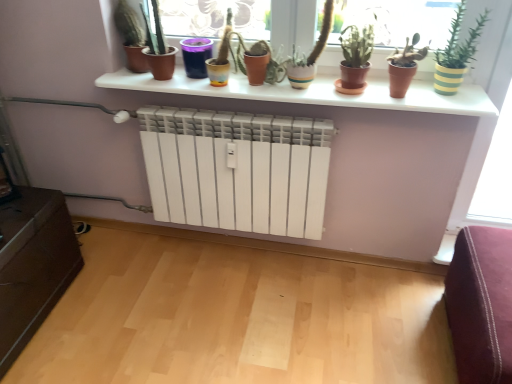
This screenshot has height=384, width=512. In order to click on matte black pot at upper left, which appears as the 1th houseplant when viewed from the left in this screenshot , I will do click(131, 36).

This screenshot has height=384, width=512. Find the location of `terracotta clay pot at center, positioned as the fourth houseplant in left-to-right order`. terracotta clay pot at center, positioned as the fourth houseplant in left-to-right order is located at coordinates (404, 67).

Describe the element at coordinates (227, 42) in the screenshot. I see `matte yellow pot at center` at that location.

At what (x,y) coordinates should I click in order to perform the action: click on green matte plant at center, placed as the third houseplant when sorted from right to left. Please return your answer as a coordinate pair (x, y). The image size is (512, 384). Looking at the image, I should click on (355, 59).

Image resolution: width=512 pixels, height=384 pixels. What do you see at coordinates (355, 59) in the screenshot?
I see `green matte plant at center, placed as the third houseplant when sorted from right to left` at bounding box center [355, 59].

I want to click on green matte cactus at upper left, arranged as the 4th houseplant when viewed from the right, so click(x=159, y=49).

Image resolution: width=512 pixels, height=384 pixels. Find the location of `yellow-green striped pot at upper right, the 5th houseplant positioned from the left`. yellow-green striped pot at upper right, the 5th houseplant positioned from the left is located at coordinates (457, 53).

Describe the element at coordinates (196, 56) in the screenshot. I see `purple glass vase at center, which is counted as the second vase, starting from the right` at that location.

What do you see at coordinates (313, 93) in the screenshot? This screenshot has width=512, height=384. I see `white matte shelf at upper center` at bounding box center [313, 93].

Identify the location of matte black pot at upper left, which appears as the 1th houseplant when viewed from the left. Image resolution: width=512 pixels, height=384 pixels. (131, 36).

Between terracotta clay pot at center, positioned as the 2th houseplant in right-to-left order, and velvet purple ottoman at lower right, which one appears on the right side from the viewer's perspective?

From the viewer's perspective, velvet purple ottoman at lower right appears more on the right side.

Would you say terracotta clay pot at center, positioned as the 2th houseplant in right-to-left order, is inside or outside velvet purple ottoman at lower right?

terracotta clay pot at center, positioned as the 2th houseplant in right-to-left order, is not enclosed by velvet purple ottoman at lower right.

From a real-world perspective, which is physically above, terracotta clay pot at center, positioned as the 2th houseplant in right-to-left order, or velvet purple ottoman at lower right?

In real-world perspective, terracotta clay pot at center, positioned as the 2th houseplant in right-to-left order, is above.

Which is less distant, (397, 55) or (456, 307)?

The point (456, 307) is in front.

Between green matte plant at center, placed as the third houseplant when sorted from right to left, and purple glass vase at center, which is counted as the second vase, starting from the right, which one is positioned behind?

purple glass vase at center, which is counted as the second vase, starting from the right, is behind.

Between green matte plant at center, the third houseplant from the left, and purple glass vase at center, the 1th vase when ordered from left to right, which one has less height?

Standing shorter between the two is purple glass vase at center, the 1th vase when ordered from left to right.

Considering the sizes of objects green matte plant at center, the third houseplant from the left, and purple glass vase at center, which is counted as the second vase, starting from the right, in the image provided, who is smaller, green matte plant at center, the third houseplant from the left, or purple glass vase at center, which is counted as the second vase, starting from the right,?

purple glass vase at center, which is counted as the second vase, starting from the right.

From a real-world perspective, who is located lower, green matte plant at center, placed as the third houseplant when sorted from right to left, or purple glass vase at center, which is counted as the second vase, starting from the right?

In real-world perspective, purple glass vase at center, which is counted as the second vase, starting from the right, is lower.

Looking at this image, what's the angular difference between green matte cactus at upper left, positioned as the 2th houseplant in left-to-right order, and terracotta clay pot at center, positioned as the fourth houseplant in left-to-right order,'s facing directions?

They differ by 1.91 degrees in their facing directions.

Looking at this image, considering the sizes of objects green matte cactus at upper left, arranged as the 4th houseplant when viewed from the right, and terracotta clay pot at center, positioned as the fourth houseplant in left-to-right order, in the image provided, who is taller, green matte cactus at upper left, arranged as the 4th houseplant when viewed from the right, or terracotta clay pot at center, positioned as the fourth houseplant in left-to-right order,?

With more height is green matte cactus at upper left, arranged as the 4th houseplant when viewed from the right.

Could you tell me if green matte cactus at upper left, positioned as the 2th houseplant in left-to-right order, is turned towards terracotta clay pot at center, positioned as the 2th houseplant in right-to-left order?

No, green matte cactus at upper left, positioned as the 2th houseplant in left-to-right order, is not oriented towards terracotta clay pot at center, positioned as the 2th houseplant in right-to-left order.

Identify the location of houseplant that is the 3rd object located above the terracotta clay pot at center, positioned as the fourth houseplant in left-to-right order (from the image's perspective). (159, 49).

Is yellow-green striped pot at upper right, the 5th houseplant positioned from the left, a part of white matte shelf at upper center?

No, yellow-green striped pot at upper right, the 5th houseplant positioned from the left, is located outside of white matte shelf at upper center.

How different are the orientations of white matte shelf at upper center and yellow-green striped pot at upper right, which appears as the 1th houseplant when viewed from the right, in degrees?

0.247 degrees separate the facing orientations of white matte shelf at upper center and yellow-green striped pot at upper right, which appears as the 1th houseplant when viewed from the right.

Measure the distance between white matte shelf at upper center and yellow-green striped pot at upper right, which appears as the 1th houseplant when viewed from the right.

12.66 inches.

Is yellow-green striped pot at upper right, which appears as the 1th houseplant when viewed from the right, at the back of white matte shelf at upper center?

No, white matte shelf at upper center is not facing away from yellow-green striped pot at upper right, which appears as the 1th houseplant when viewed from the right.

What's the angular difference between yellow-green striped pot at upper right, the 5th houseplant positioned from the left, and purple glass vase at center, which is counted as the second vase, starting from the right,'s facing directions?

0.613 degrees separate the facing orientations of yellow-green striped pot at upper right, the 5th houseplant positioned from the left, and purple glass vase at center, which is counted as the second vase, starting from the right.

Looking at this image, from the image's perspective, would you say yellow-green striped pot at upper right, which appears as the 1th houseplant when viewed from the right, is positioned over purple glass vase at center, which is counted as the second vase, starting from the right?

Actually, yellow-green striped pot at upper right, which appears as the 1th houseplant when viewed from the right, appears below purple glass vase at center, which is counted as the second vase, starting from the right, in the image.

Is point (458, 38) positioned behind point (192, 49)?

No.

Is yellow-green striped pot at upper right, the 5th houseplant positioned from the left, turned away from purple glass vase at center, which is counted as the second vase, starting from the right?

yellow-green striped pot at upper right, the 5th houseplant positioned from the left, is not turned away from purple glass vase at center, which is counted as the second vase, starting from the right.

Between white matte radiator at center and green matte cactus at upper left, positioned as the 2th houseplant in left-to-right order, which one is positioned behind?

Positioned behind is green matte cactus at upper left, positioned as the 2th houseplant in left-to-right order.

The width and height of the screenshot is (512, 384). Identify the location of the 4th houseplant directly above the white matte radiator at center (from a real-world perspective). (159, 49).

Is point (128, 275) behind point (167, 62)?

Yes.

Could green matte cactus at upper left, arranged as the 4th houseplant when viewed from the right, be considered to be inside white matte radiator at center?

No, green matte cactus at upper left, arranged as the 4th houseplant when viewed from the right, is located outside of white matte radiator at center.

Is velvet purple ottoman at lower right inside or outside of green matte plant at center, the third houseplant from the left?

The correct answer is: outside.

Which object is positioned more to the right, velvet purple ottoman at lower right or green matte plant at center, placed as the third houseplant when sorted from right to left?

velvet purple ottoman at lower right is more to the right.

Consider the image. Considering the sizes of objects velvet purple ottoman at lower right and green matte plant at center, the third houseplant from the left, in the image provided, who is thinner, velvet purple ottoman at lower right or green matte plant at center, the third houseplant from the left,?

green matte plant at center, the third houseplant from the left, is thinner.

Locate an element on the screen. The image size is (512, 384). furniture lying in front of the green matte plant at center, the third houseplant from the left is located at coordinates (481, 304).

This screenshot has height=384, width=512. Identify the location of furniture in front of the terracotta clay pot at center, positioned as the fourth houseplant in left-to-right order. (481, 304).

At what (x,y) coordinates should I click in order to perform the action: click on the 1st vase directly beneath the green matte plant at center, placed as the third houseplant when sorted from right to left (from a real-world perspective). Please return your answer as a coordinate pair (x, y). The height and width of the screenshot is (384, 512). Looking at the image, I should click on (196, 56).

Looking at the image, which one is located closer to matte terracotta pot at center, which is the first vase from right to left, matte black pot at upper left, which appears as the 1th houseplant when viewed from the left, or yellow-green striped pot at upper right, the 5th houseplant positioned from the left?

matte black pot at upper left, which appears as the 1th houseplant when viewed from the left, lies closer to matte terracotta pot at center, which is the first vase from right to left, than the other object.

Estimate the real-world distances between objects in this image. Which object is further from matte yellow pot at center, matte black pot at upper left, acting as the 5th houseplant starting from the right, or matte terracotta pot at center, the 2th vase from the left?

Based on the image, matte black pot at upper left, acting as the 5th houseplant starting from the right, appears to be further to matte yellow pot at center.

From the image, which object appears to be farther from green matte cactus at upper left, arranged as the 4th houseplant when viewed from the right, green matte plant at center, placed as the third houseplant when sorted from right to left, or terracotta clay pot at center, positioned as the fourth houseplant in left-to-right order?

terracotta clay pot at center, positioned as the fourth houseplant in left-to-right order.

Considering their positions, is white matte shelf at upper center positioned closer to white matte radiator at center than velvet purple ottoman at lower right?

Based on the image, velvet purple ottoman at lower right appears to be nearer to white matte radiator at center.

Estimate the real-world distances between objects in this image. Which object is closer to terracotta clay pot at center, positioned as the fourth houseplant in left-to-right order, yellow-green striped pot at upper right, the 5th houseplant positioned from the left, or matte terracotta pot at center, which is the first vase from right to left?

Based on the image, yellow-green striped pot at upper right, the 5th houseplant positioned from the left, appears to be nearer to terracotta clay pot at center, positioned as the fourth houseplant in left-to-right order.

Based on their spatial positions, is yellow-green striped pot at upper right, which appears as the 1th houseplant when viewed from the right, or matte terracotta pot at center, which is the first vase from right to left, closer to green matte plant at center, placed as the third houseplant when sorted from right to left?

The object closer to green matte plant at center, placed as the third houseplant when sorted from right to left, is yellow-green striped pot at upper right, which appears as the 1th houseplant when viewed from the right.

When comparing their distances from white matte radiator at center, does matte black pot at upper left, acting as the 5th houseplant starting from the right, or white matte shelf at upper center seem further?

The object further to white matte radiator at center is matte black pot at upper left, acting as the 5th houseplant starting from the right.

Estimate the real-world distances between objects in this image. Which object is further from terracotta clay pot at center, positioned as the fourth houseplant in left-to-right order, purple glass vase at center, which is counted as the second vase, starting from the right, or matte terracotta pot at center, which is the first vase from right to left?

Based on the image, purple glass vase at center, which is counted as the second vase, starting from the right, appears to be further to terracotta clay pot at center, positioned as the fourth houseplant in left-to-right order.

What are the coordinates of `shelf between green matte cactus at upper left, positioned as the 2th houseplant in left-to-right order, and velvet purple ottoman at lower right` in the screenshot? It's located at (313, 93).

Locate an element on the screen. This screenshot has width=512, height=384. vase between matte black pot at upper left, acting as the 5th houseplant starting from the right, and matte terracotta pot at center, the 2th vase from the left is located at coordinates (196, 56).

The height and width of the screenshot is (384, 512). In order to click on shelf located between matte terracotta pot at center, which is the first vase from right to left, and yellow-green striped pot at upper right, the 5th houseplant positioned from the left, in the left-right direction in this screenshot , I will do `click(313, 93)`.

Identify the location of vase between purple glass vase at center, the 1th vase when ordered from left to right, and green matte plant at center, placed as the third houseplant when sorted from right to left, in the horizontal direction. (256, 67).